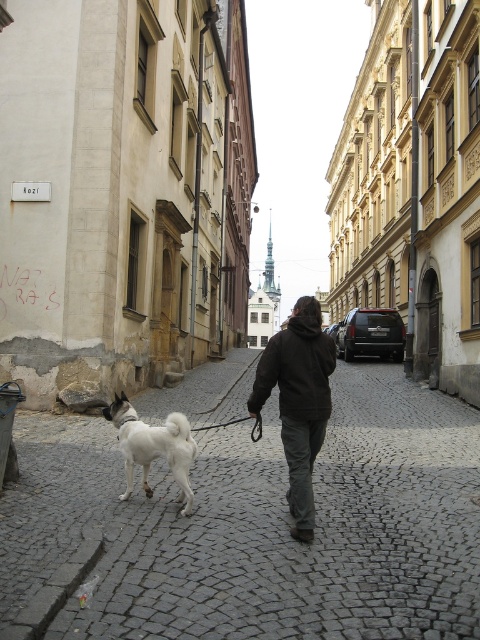
Consider the image. Does dark brown hoodie at center appear under white fluffy dog at lower left?

Actually, dark brown hoodie at center is above white fluffy dog at lower left.

Which is in front, point (313, 317) or point (177, 448)?

Point (313, 317)

Locate an element on the screen. dark brown hoodie at center is located at coordinates (x=299, y=401).

Does white fur dog at center have a greater height compared to white fluffy dog at lower left?

Incorrect, white fur dog at center's height is not larger of white fluffy dog at lower left's.

Who is more distant from viewer, (92, 538) or (172, 424)?

Positioned behind is point (172, 424).

I want to click on white fur dog at center, so tap(252, 528).

Who is positioned more to the left, white fur dog at center or dark brown hoodie at center?

white fur dog at center

Does point (98, 512) lie in front of point (303, 496)?

No, (98, 512) is behind (303, 496).

This screenshot has width=480, height=640. Identify the location of white fur dog at center. (252, 528).